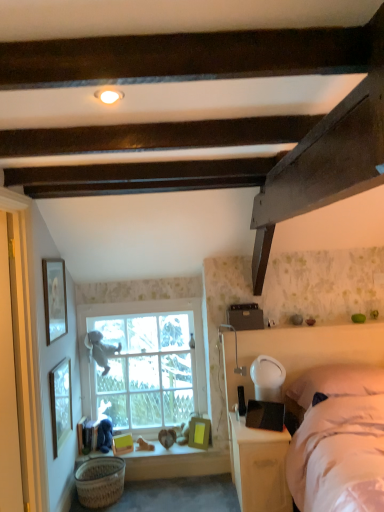
I want to click on free point above clear glass window at center (from a real-world perspective), so click(139, 302).